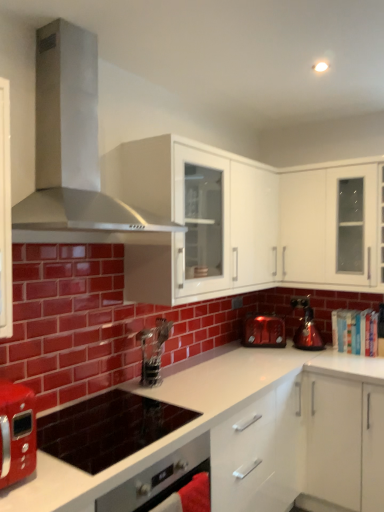
Identify the location of empty space that is ontop of matte black cooktop at center (from a real-world perspective). This screenshot has height=512, width=384. (119, 422).